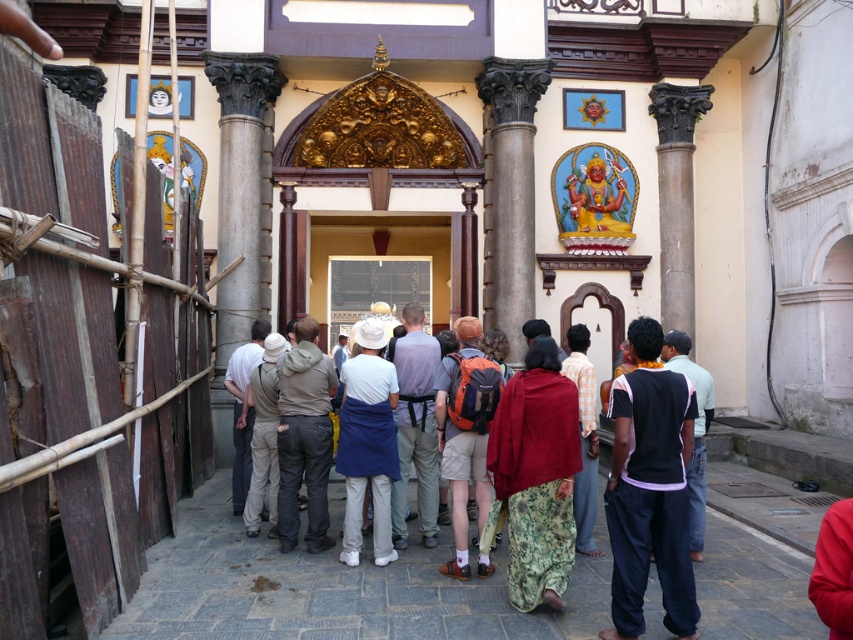
Question: Which of these objects is positioned farthest from the gray stone column at center?

Choices:
 (A) green floral saree at center
 (B) dark gray pants at center
 (C) orange fabric backpack at center

Answer: (A)

Question: Does dark gray stone column at center have a greater width compared to white cotton hat at center?

Choices:
 (A) yes
 (B) no

Answer: (B)

Question: Can you confirm if black cotton shirt at center is thinner than khaki cotton pants at center?

Choices:
 (A) no
 (B) yes

Answer: (B)

Question: Can you confirm if orange fabric backpack at center is thinner than khaki cotton pants at center?

Choices:
 (A) yes
 (B) no

Answer: (A)

Question: Among these objects, which one is farthest from the camera?

Choices:
 (A) khaki cotton pants at center
 (B) green floral saree at center
 (C) gray stone column at center

Answer: (C)

Question: Which point is closer to the camera?

Choices:
 (A) (227, 205)
 (B) (671, 397)
 (C) (438, 428)

Answer: (B)